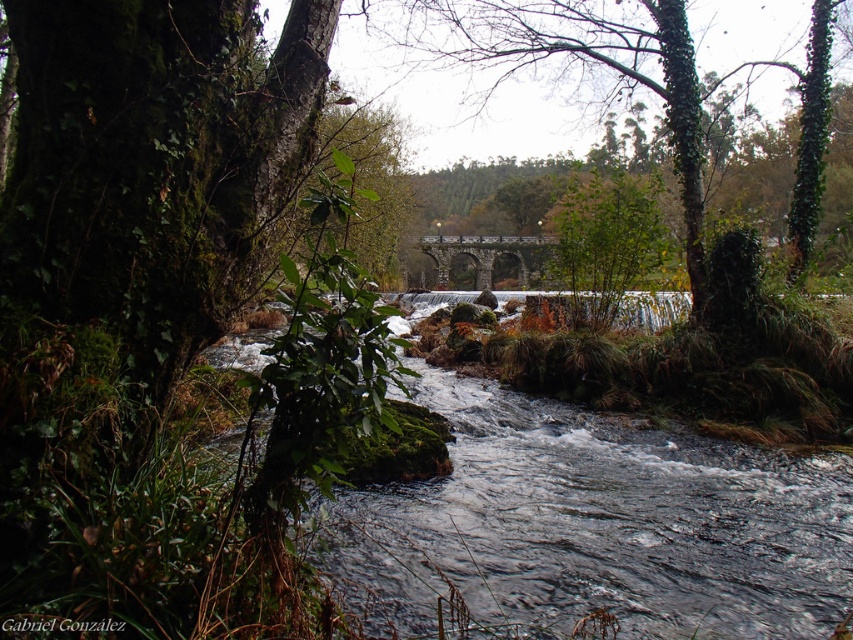
Question: Which point is farther from the camera taking this photo?

Choices:
 (A) (666, 513)
 (B) (793, 211)

Answer: (B)

Question: Which object is the closest to the stone arch bridge at center?

Choices:
 (A) clear water at center
 (B) green leafy tree at center

Answer: (B)

Question: Which of these objects is positioned closest to the stone arch bridge at center?

Choices:
 (A) clear water at center
 (B) green leafy tree at center

Answer: (B)

Question: Does clear water at center appear under stone arch bridge at center?

Choices:
 (A) yes
 (B) no

Answer: (A)

Question: Can you confirm if green leafy tree at center is thinner than stone arch bridge at center?

Choices:
 (A) no
 (B) yes

Answer: (A)

Question: Is clear water at center thinner than stone arch bridge at center?

Choices:
 (A) yes
 (B) no

Answer: (A)